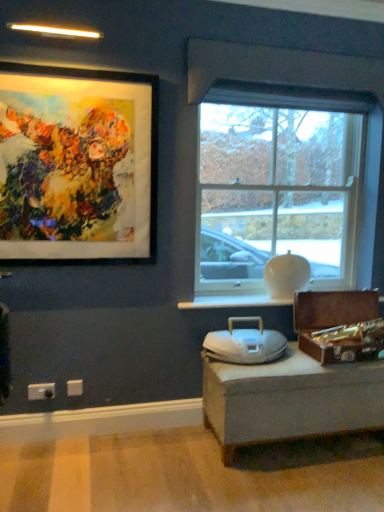
Question: Which is correct: white plastic electric outlet at lower left, which ranks as the 2th electric outlet in right-to-left order, is inside clear glass window at center, or outside of it?

Choices:
 (A) inside
 (B) outside

Answer: (B)

Question: Looking at the image, does white plastic electric outlet at lower left, which ranks as the 2th electric outlet in right-to-left order, seem bigger or smaller compared to clear glass window at center?

Choices:
 (A) small
 (B) big

Answer: (A)

Question: Based on their relative distances, which object is farther from the matte black picture frame at upper left?

Choices:
 (A) white plastic swivel chair at center
 (B) white plastic electric outlet at lower left, which is the 2th electric outlet in left-to-right order
 (C) white plastic electric outlet at lower left, which is the 1th electric outlet in left-to-right order
 (D) clear glass window at center
 (E) white glossy window sill at center

Answer: (C)

Question: Estimate the real-world distances between objects in this image. Which object is closer to the white plastic electric outlet at lower left, the second electric outlet when ordered from back to front?

Choices:
 (A) matte black picture frame at upper left
 (B) white plastic swivel chair at center
 (C) white glossy window sill at center
 (D) clear glass window at center
 (E) white plastic electric outlet at lower left, positioned as the first electric outlet in back-to-front order

Answer: (E)